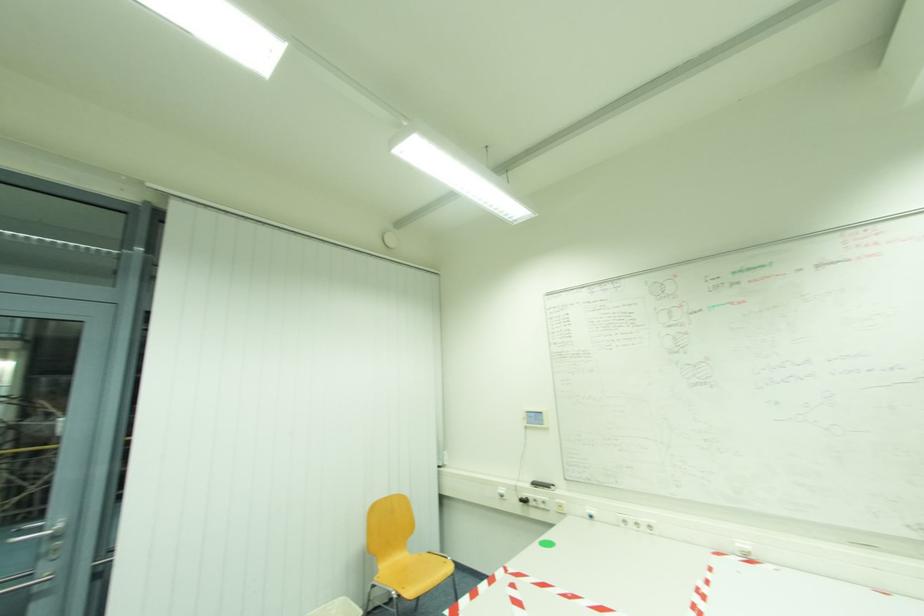
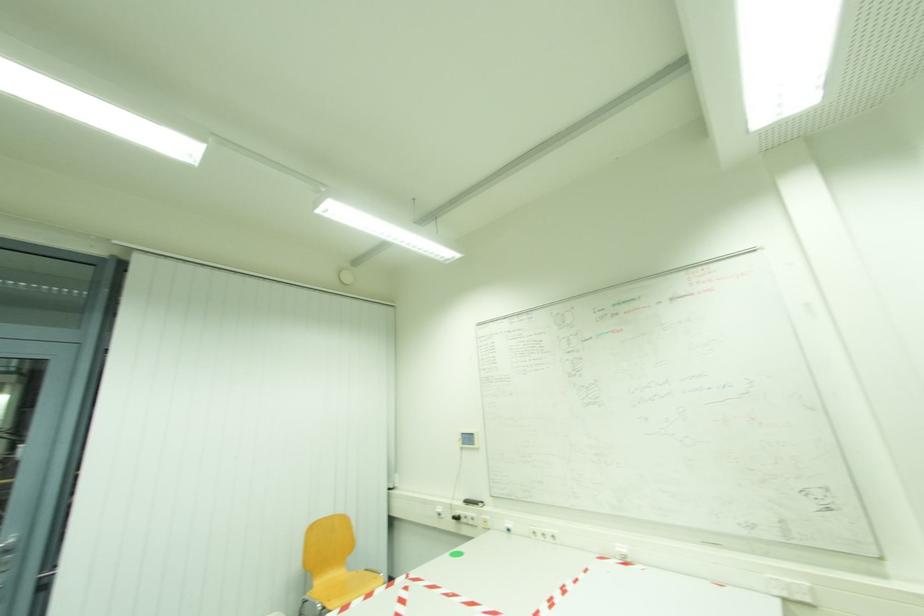
Question: How did the camera likely rotate?

Choices:
 (A) Left
 (B) Right
 (C) Up
 (D) Down

Answer: (C)